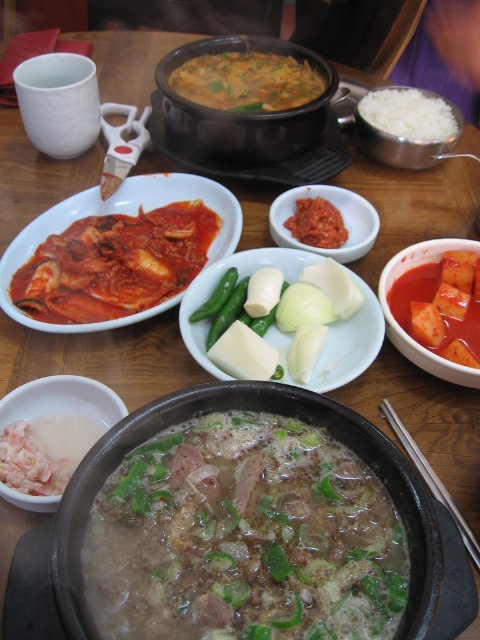
You are a photographer trying to capture the kimchi plate at point [444,285] and the broth pot at point [380,115]. Which object will appear larger in your photo?

The kimchi plate at point [444,285] will appear larger in the photo because it is closer to the camera than the broth pot at point [380,115].

You are sitting at the table and want to reach the white shredded meat at lower left. Which direction should you move your hand relative to the matte ceramic pot at center?

You should move your hand to the left of the matte ceramic pot at center to reach the white shredded meat at lower left, since the white shredded meat at lower left is positioned to the left of the matte ceramic pot at center.